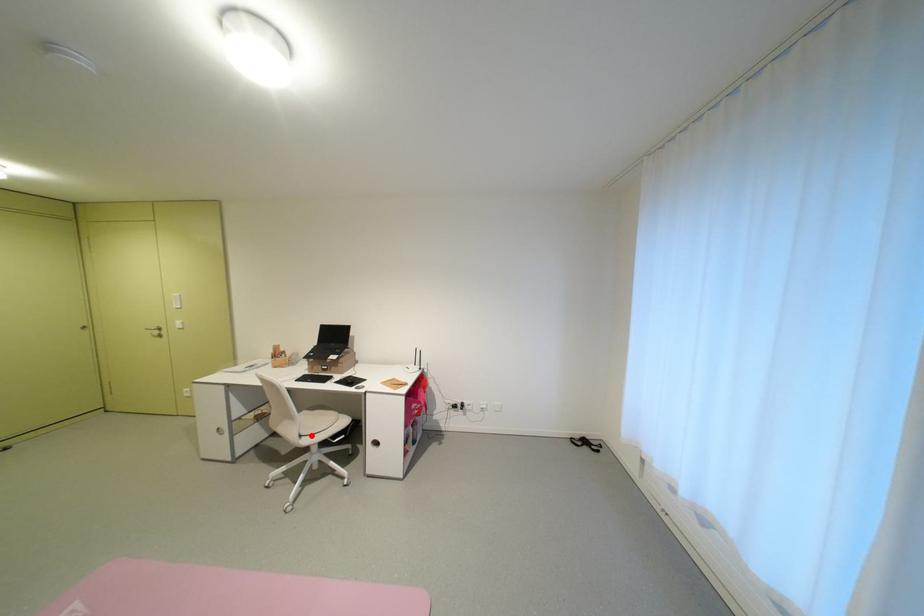
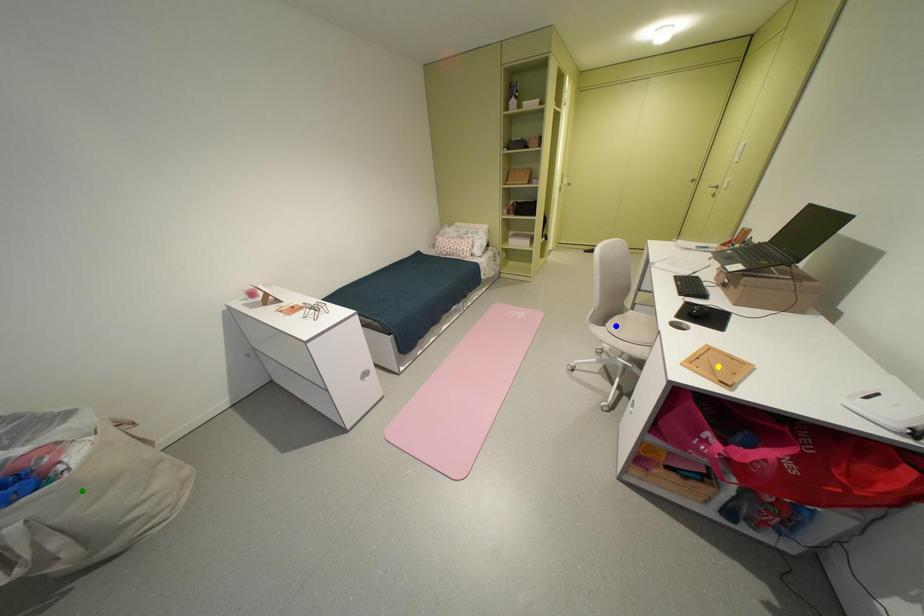
Question: I am providing you with two images of the same scene from different viewpoints. A red point is marked on the first image. You are given multiple points on the second image. In image 2, which mark is for the same physical point as the one in image 1?

Choices:
 (A) green point
 (B) yellow point
 (C) blue point

Answer: (C)